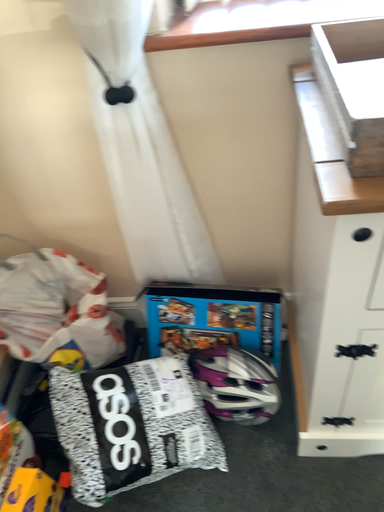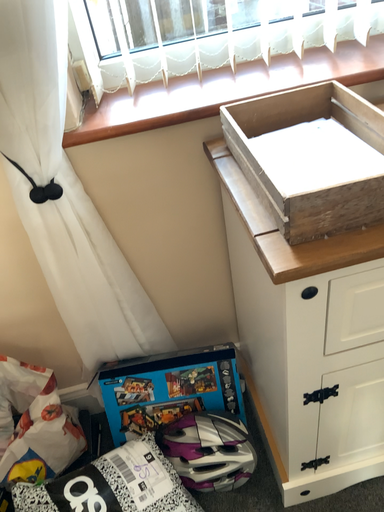
Question: How did the camera likely rotate when shooting the video?

Choices:
 (A) rotated upward
 (B) rotated downward

Answer: (A)